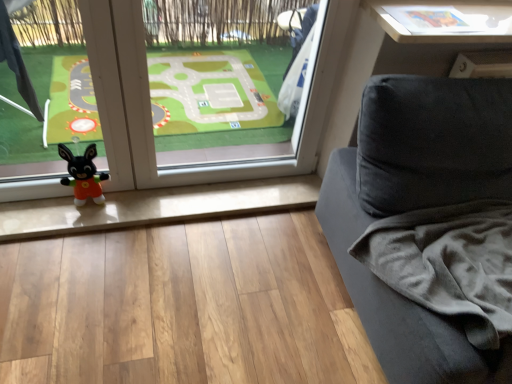
Question: From their relative heights in the image, would you say transparent glass window at center is taller or shorter than white glossy table at upper right?

Choices:
 (A) short
 (B) tall

Answer: (B)

Question: From a real-world perspective, is transparent glass window at center physically located above or below white glossy table at upper right?

Choices:
 (A) above
 (B) below

Answer: (B)

Question: Is transparent glass window at center wider or thinner than white glossy table at upper right?

Choices:
 (A) thin
 (B) wide

Answer: (B)

Question: From the image's perspective, relative to transparent glass window at center, is white glossy table at upper right above or below?

Choices:
 (A) below
 (B) above

Answer: (B)

Question: Is white glossy table at upper right spatially inside transparent glass window at center, or outside of it?

Choices:
 (A) outside
 (B) inside

Answer: (A)

Question: From a real-world perspective, is white glossy table at upper right positioned above or below transparent glass window at center?

Choices:
 (A) above
 (B) below

Answer: (A)

Question: Considering the positions of point (439, 9) and point (4, 127), is point (439, 9) closer or farther from the camera than point (4, 127)?

Choices:
 (A) closer
 (B) farther

Answer: (A)